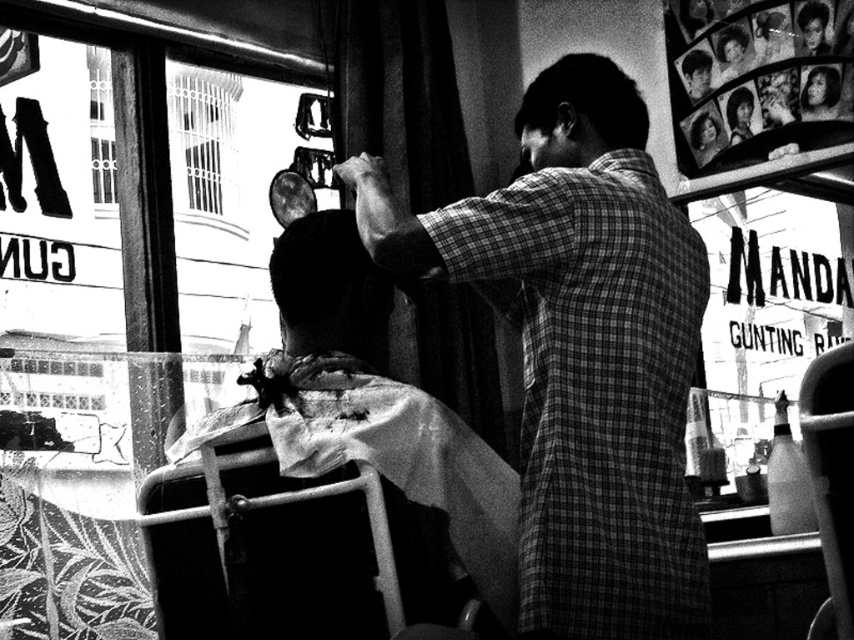
Based on the photo, you are a customer entering the barbershop and see the metallic silver chair at lower center and the metallic white chair at center. Which chair would you sit on if you want a more spacious seating option?

The metallic silver chair at lower center has a larger size compared to the metallic white chair at center, so you should choose the metallic silver chair at lower center for a more spacious seating option.

Based on the scene description, where is the checkered fabric shirt at center located in the image?

The checkered fabric shirt at center is located at point 0.550 in the x coordinate and 0.684 in the y coordinate.